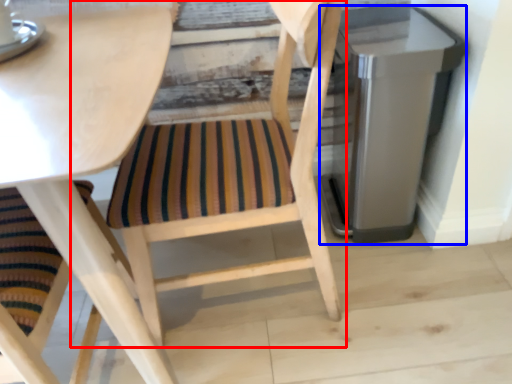
Question: Which of the following is the closest to the observer, chair (highlighted by a red box) or appliance (highlighted by a blue box)?

Choices:
 (A) chair
 (B) appliance

Answer: (A)